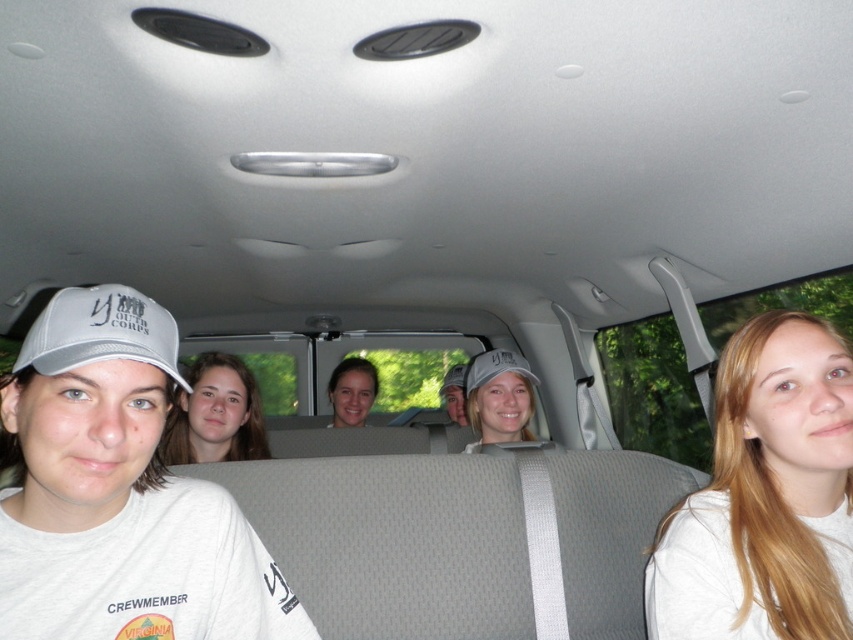
You are a delivery robot that is 1.8 meters tall. You need to pass between the gray fabric baseball cap at left and the matte gray cap at center in the van. Can you fit through the space between them vertically?

The distance between the gray fabric baseball cap at left and matte gray cap at center is 1.91 meters. Since the robot is 1.8 meters tall, it can fit through vertically as the space is slightly larger than the robot.